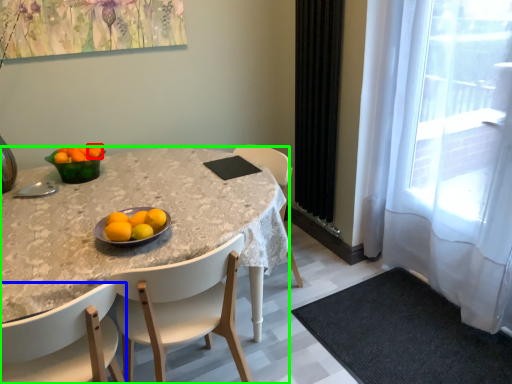
Question: Which object is the farthest from tangerine (highlighted by a red box)? Choose among these: chair (highlighted by a blue box) or desk (highlighted by a green box).

Choices:
 (A) chair
 (B) desk

Answer: (A)